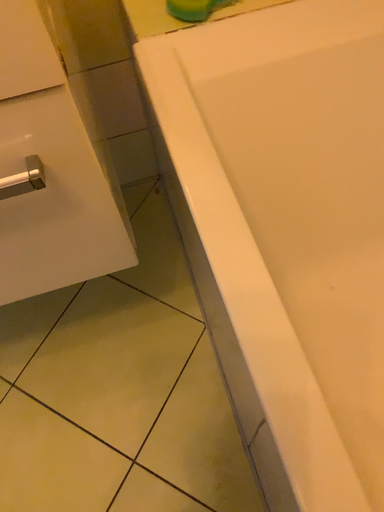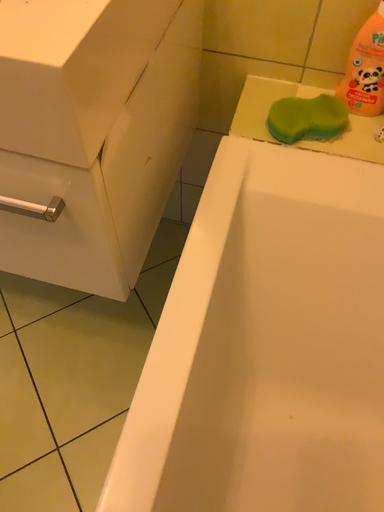
Question: How did the camera likely rotate when shooting the video?

Choices:
 (A) rotated left
 (B) rotated right

Answer: (A)